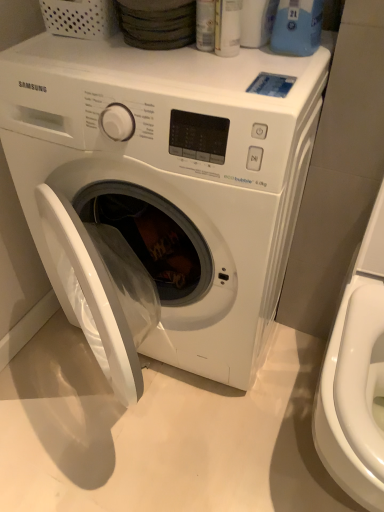
Question: Should I look upward or downward to see white glossy washer at right?

Choices:
 (A) down
 (B) up

Answer: (A)

Question: Considering the relative sizes of white glossy washer at right and blue plastic bottle at upper right in the image provided, is white glossy washer at right taller than blue plastic bottle at upper right?

Choices:
 (A) yes
 (B) no

Answer: (A)

Question: Is white glossy washer at right thinner than blue plastic bottle at upper right?

Choices:
 (A) yes
 (B) no

Answer: (B)

Question: From the image's perspective, is white glossy washer at right below blue plastic bottle at upper right?

Choices:
 (A) no
 (B) yes

Answer: (B)

Question: Is white glossy washer at right outside of blue plastic bottle at upper right?

Choices:
 (A) no
 (B) yes

Answer: (B)

Question: Considering the relative sizes of white glossy washer at right and blue plastic bottle at upper right in the image provided, is white glossy washer at right bigger than blue plastic bottle at upper right?

Choices:
 (A) yes
 (B) no

Answer: (A)

Question: Is white glossy washer at right to the right of blue plastic bottle at upper right from the viewer's perspective?

Choices:
 (A) yes
 (B) no

Answer: (A)

Question: Is blue plastic bottle at upper right bigger than white glossy washing machine at center?

Choices:
 (A) yes
 (B) no

Answer: (B)

Question: Can you confirm if blue plastic bottle at upper right is thinner than white glossy washing machine at center?

Choices:
 (A) yes
 (B) no

Answer: (A)

Question: Does blue plastic bottle at upper right turn towards white glossy washing machine at center?

Choices:
 (A) no
 (B) yes

Answer: (A)

Question: Would you say blue plastic bottle at upper right contains white glossy washing machine at center?

Choices:
 (A) yes
 (B) no

Answer: (B)

Question: From a real-world perspective, is blue plastic bottle at upper right located higher than white glossy washing machine at center?

Choices:
 (A) yes
 (B) no

Answer: (A)

Question: Does blue plastic bottle at upper right have a greater width compared to white glossy washing machine at center?

Choices:
 (A) no
 (B) yes

Answer: (A)

Question: Is white glossy washer at right facing away from white glossy washing machine at center?

Choices:
 (A) no
 (B) yes

Answer: (A)